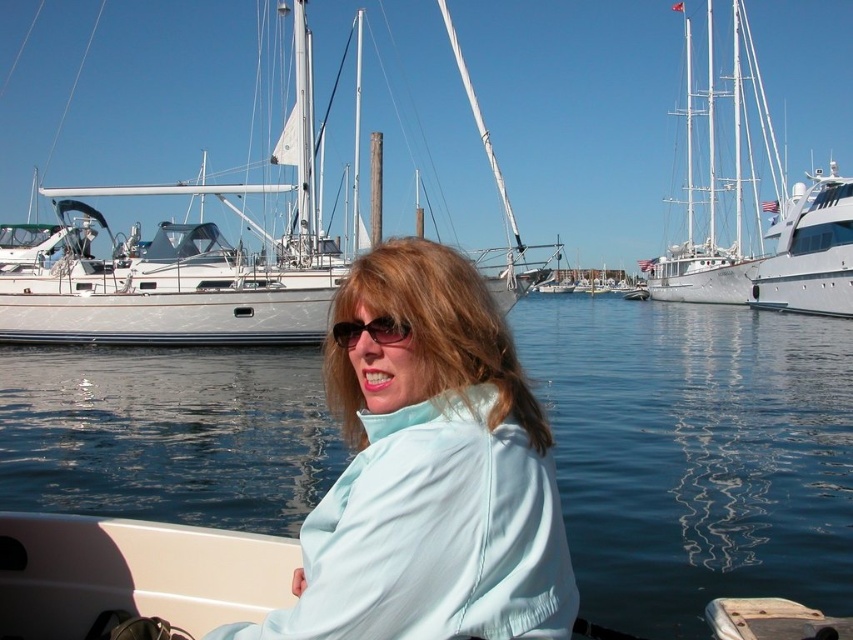
Question: Which point appears closest to the camera in this image?

Choices:
 (A) (837, 188)
 (B) (804, 481)

Answer: (B)

Question: Does clear blue water at center have a larger size compared to white glossy yacht at right?

Choices:
 (A) yes
 (B) no

Answer: (A)

Question: Which is farther from the white glossy sailboat at upper center?

Choices:
 (A) light blue fabric at center
 (B) white glossy yacht at right
 (C) clear blue water at center
 (D) white matte sailboat at upper left

Answer: (A)

Question: Can you confirm if white glossy yacht at right is positioned to the left of matte black sunglasses at center?

Choices:
 (A) yes
 (B) no

Answer: (B)

Question: Which object is the farthest from the white matte sailboat at upper left?

Choices:
 (A) clear blue water at center
 (B) white glossy sailboat at upper center
 (C) light blue fabric at center

Answer: (B)

Question: Is white matte sailboat at upper left closer to the viewer compared to white glossy yacht at right?

Choices:
 (A) yes
 (B) no

Answer: (A)